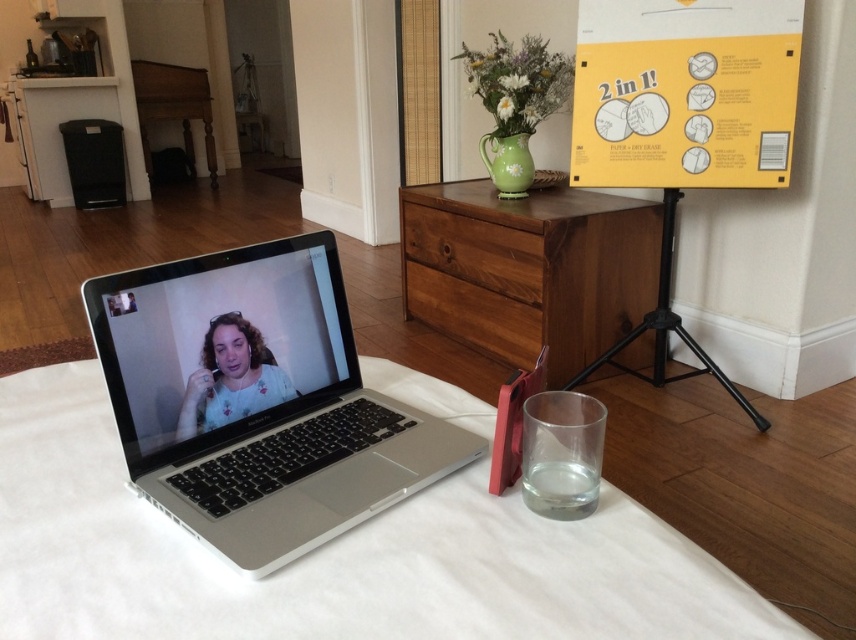
How far apart are white fabric table at center and wooden drawer at center?

white fabric table at center and wooden drawer at center are 4.80 feet apart.

Who is more forward, (x=363, y=602) or (x=450, y=317)?

Point (x=363, y=602)

Locate an element on the screen. The height and width of the screenshot is (640, 856). white fabric table at center is located at coordinates (331, 556).

Is wooden drawer at center to the left of black metal tripod at lower right from the viewer's perspective?

Yes, wooden drawer at center is to the left of black metal tripod at lower right.

Where is `wooden drawer at center`? The image size is (856, 640). wooden drawer at center is located at coordinates (473, 314).

The image size is (856, 640). I want to click on wooden drawer at center, so click(x=473, y=314).

Who is positioned more to the left, white fabric table at center or brown wood drawer at center?

white fabric table at center is more to the left.

Between point (516, 552) and point (496, 246), which one is positioned behind?

Positioned behind is point (496, 246).

Locate an element on the screen. This screenshot has width=856, height=640. white fabric table at center is located at coordinates (331, 556).